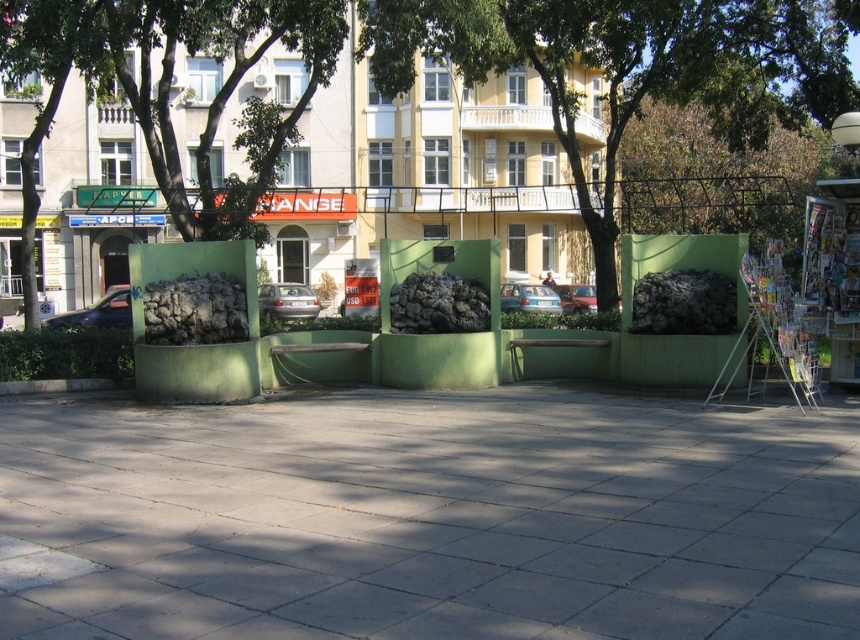
Question: Can you confirm if gray concrete pavement at center is positioned above green leafy tree at center?

Choices:
 (A) yes
 (B) no

Answer: (B)

Question: Can you confirm if gray concrete pavement at center is wider than green leafy tree at center?

Choices:
 (A) no
 (B) yes

Answer: (A)

Question: Does gray concrete pavement at center appear on the right side of green leafy tree at center?

Choices:
 (A) no
 (B) yes

Answer: (A)